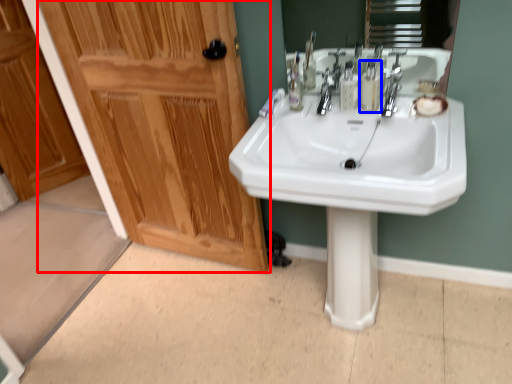
Question: Which point is closer to the camera, door (highlighted by a red box) or mouthwash (highlighted by a blue box)?

Choices:
 (A) door
 (B) mouthwash

Answer: (A)